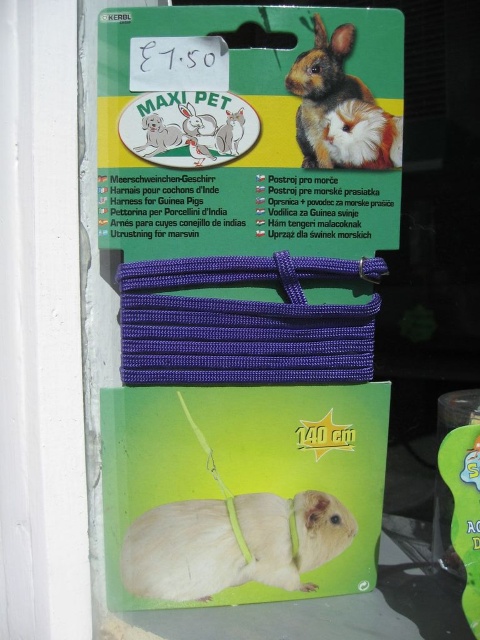
From the picture: Who is lower down, white matte hamster at center or fluffy brown hamster at upper right?

white matte hamster at center is lower down.

Does white matte hamster at center have a lesser height compared to fluffy brown hamster at upper right?

Indeed, white matte hamster at center has a lesser height compared to fluffy brown hamster at upper right.

Is point (229, 524) positioned before point (298, 141)?

No, it is not.

Where is `white matte hamster at center`? The height and width of the screenshot is (640, 480). white matte hamster at center is located at coordinates (232, 544).